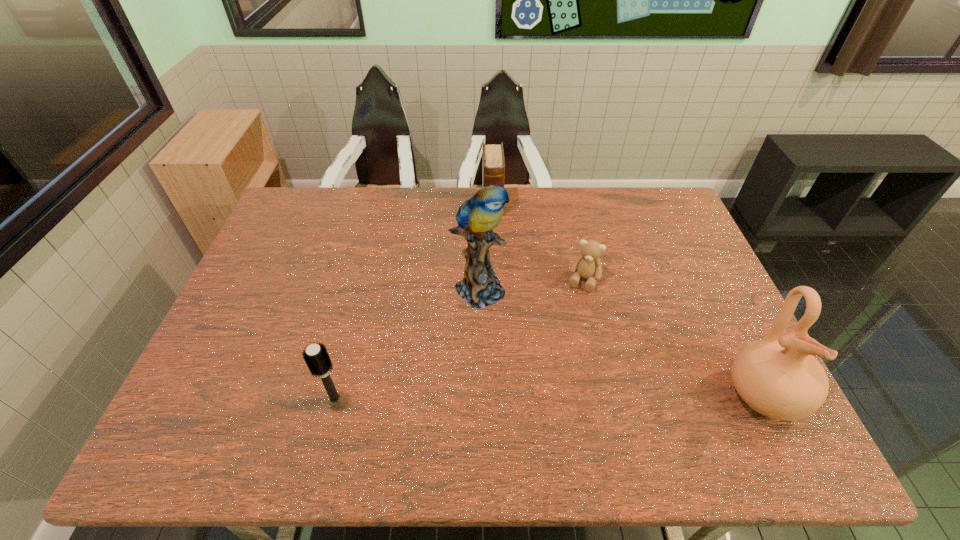
Locate an element on the screen. the leftmost object is located at coordinates (316, 356).

Identify the location of the rightmost object. The image size is (960, 540). (777, 376).

Identify the location of pottery. Image resolution: width=960 pixels, height=540 pixels. (777, 376).

I want to click on parrot, so pyautogui.click(x=477, y=217).

The image size is (960, 540). Identify the location of teddy bear. (587, 265).

Identify the location of the shortest object. (587, 265).

The height and width of the screenshot is (540, 960). I want to click on diary, so click(493, 173).

The width and height of the screenshot is (960, 540). I want to click on vacant area situated 0.320m on the right of the leftmost object, so click(x=483, y=398).

You are a GUI agent. You are given a task and a screenshot of the screen. Output one action in this format:
    pyautogui.click(x=<x>, y=<y>)
    Task: Click on the free space located on the face of the parrot
    The width and height of the screenshot is (960, 540).
    Given the screenshot: What is the action you would take?
    pyautogui.click(x=527, y=333)

Locate an element on the screen. vacant region located on the face of the parrot is located at coordinates tap(564, 364).